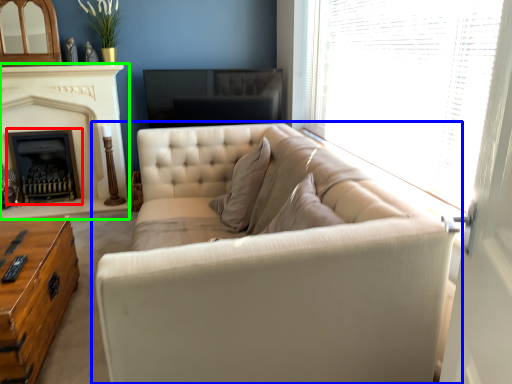
Question: Which is nearer to the fireplace (highlighted by a red box)? studio couch (highlighted by a blue box) or fireplace (highlighted by a green box).

Choices:
 (A) studio couch
 (B) fireplace

Answer: (B)